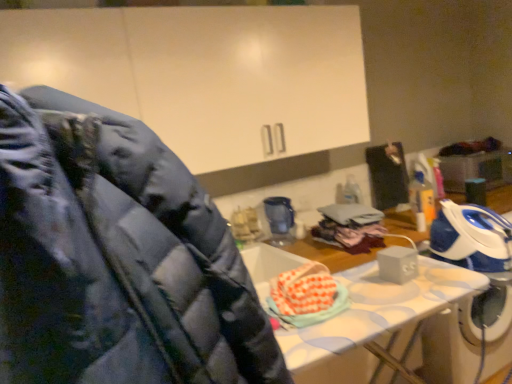
Question: From their relative heights in the image, would you say black fabric suit at upper right is taller or shorter than blue plastic blender at center?

Choices:
 (A) tall
 (B) short

Answer: (A)

Question: Is black fabric suit at upper right bigger or smaller than blue plastic blender at center?

Choices:
 (A) small
 (B) big

Answer: (B)

Question: Relative to blue plastic blender at center, is black fabric suit at upper right in front or behind?

Choices:
 (A) behind
 (B) front

Answer: (A)

Question: From a real-world perspective, is blue plastic blender at center physically located above or below black fabric suit at upper right?

Choices:
 (A) below
 (B) above

Answer: (A)

Question: Considering the positions of blue plastic blender at center and black fabric suit at upper right in the image, is blue plastic blender at center wider or thinner than black fabric suit at upper right?

Choices:
 (A) thin
 (B) wide

Answer: (B)

Question: Is blue plastic blender at center spatially inside black fabric suit at upper right, or outside of it?

Choices:
 (A) inside
 (B) outside

Answer: (B)

Question: Considering the positions of blue plastic blender at center and black fabric suit at upper right in the image, is blue plastic blender at center bigger or smaller than black fabric suit at upper right?

Choices:
 (A) big
 (B) small

Answer: (B)